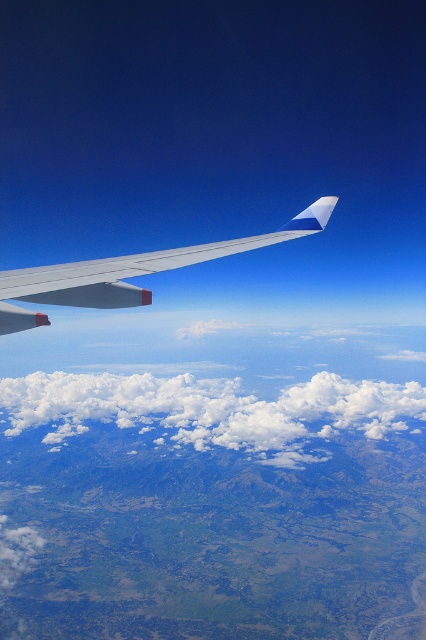
Question: Among these points, which one is farthest from the camera?

Choices:
 (A) (11, 554)
 (B) (132, 396)
 (C) (2, 280)

Answer: (B)

Question: Which point is farther to the camera?

Choices:
 (A) silver metallic wing at upper center
 (B) white fluffy cloud at center
 (C) white fluffy cloud at lower left

Answer: (B)

Question: Can you confirm if white fluffy cloud at center is positioned below white fluffy cloud at lower left?

Choices:
 (A) yes
 (B) no

Answer: (B)

Question: Does white fluffy cloud at center have a smaller size compared to silver metallic wing at upper center?

Choices:
 (A) yes
 (B) no

Answer: (B)

Question: Is white fluffy cloud at center positioned in front of silver metallic wing at upper center?

Choices:
 (A) no
 (B) yes

Answer: (A)

Question: Estimate the real-world distances between objects in this image. Which object is closer to the silver metallic wing at upper center?

Choices:
 (A) white fluffy cloud at center
 (B) white fluffy cloud at lower left

Answer: (A)